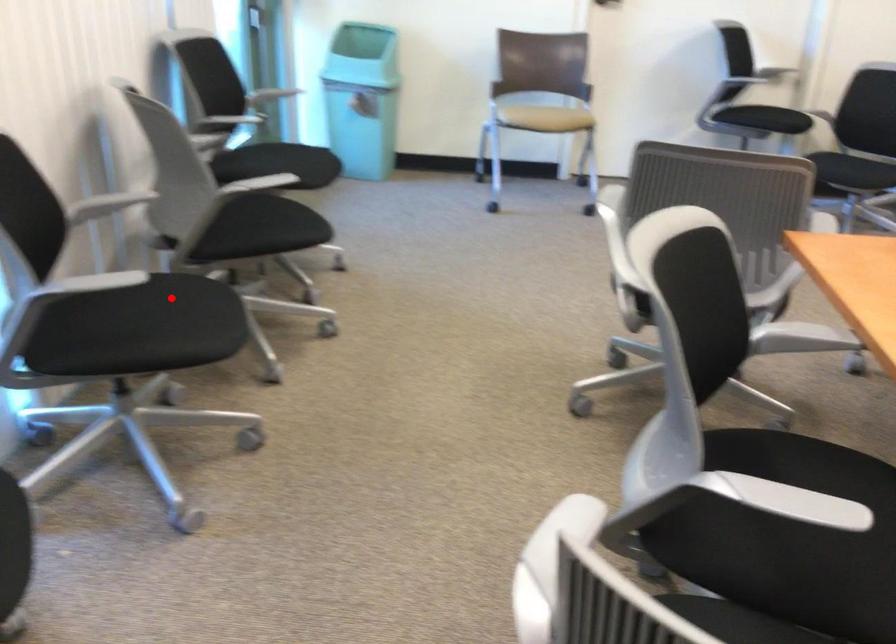
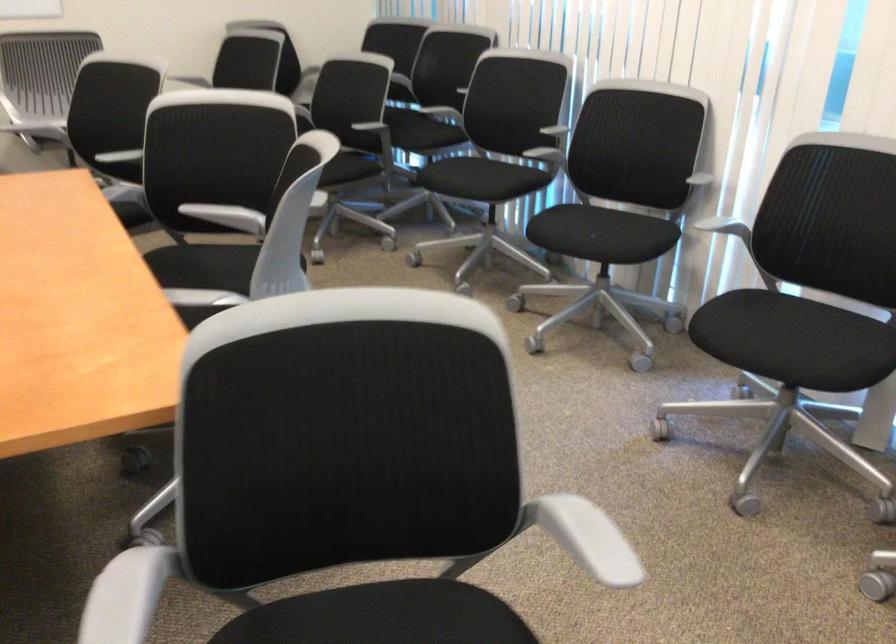
In the second image, find the point that corresponds to the highlighted location in the first image.

(795, 342)